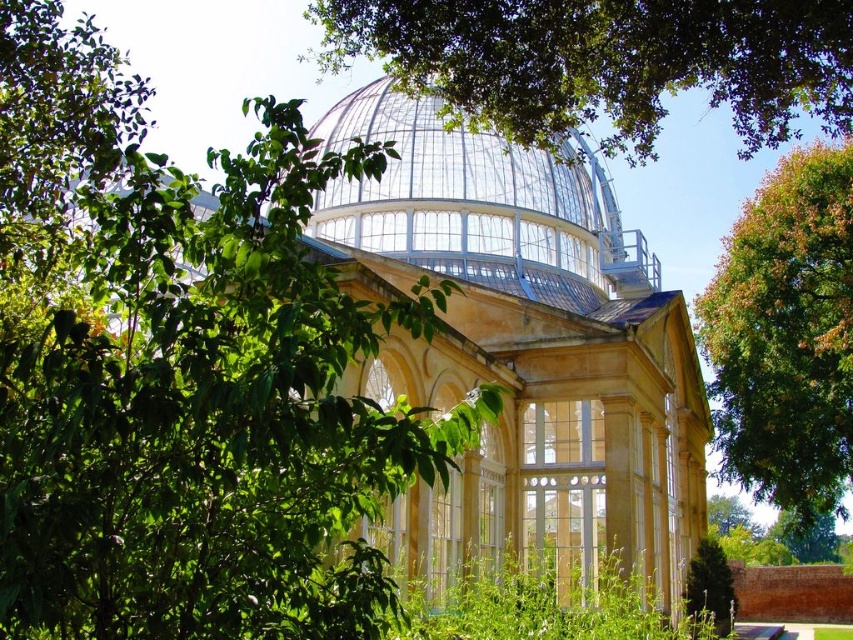
You are standing in a classical conservatory and notice the matte glass dome at center and the green leafy tree at upper center. Which object is located to the left of the other?

The matte glass dome at center is positioned on the left side of green leafy tree at upper center.

You are standing in a classical conservatory with a glass roof. You see a point marked at coordinates (x=521, y=349). What object is located at that point?

The point at coordinates (x=521, y=349) corresponds to the matte glass dome at center.

You are a landscape architect designing a new garden layout. You need to ensure that the matte glass dome at center and the green leafy tree at upper center are visible from the main entrance pathway. Given their sizes, which object would appear more prominent in the view from the pathway?

The matte glass dome at center is larger in size than the green leafy tree at upper center, so it would appear more prominent in the view from the pathway.